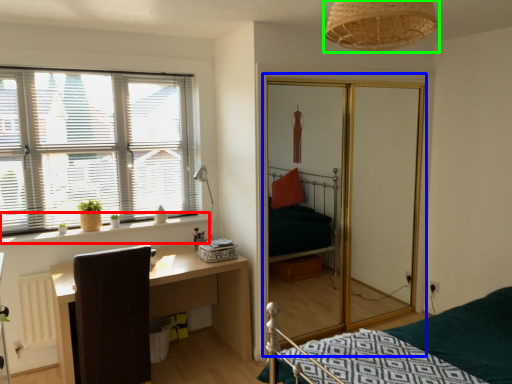
Question: Estimate the real-world distances between objects in this image. Which object is farther from window sill (highlighted by a red box), screen door (highlighted by a blue box) or light fixture (highlighted by a green box)?

Choices:
 (A) screen door
 (B) light fixture

Answer: (B)